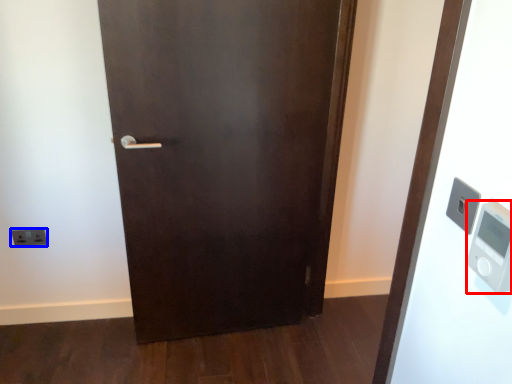
Question: Which object is further to the camera taking this photo, thermometer (highlighted by a red box) or light switch (highlighted by a blue box)?

Choices:
 (A) thermometer
 (B) light switch

Answer: (B)